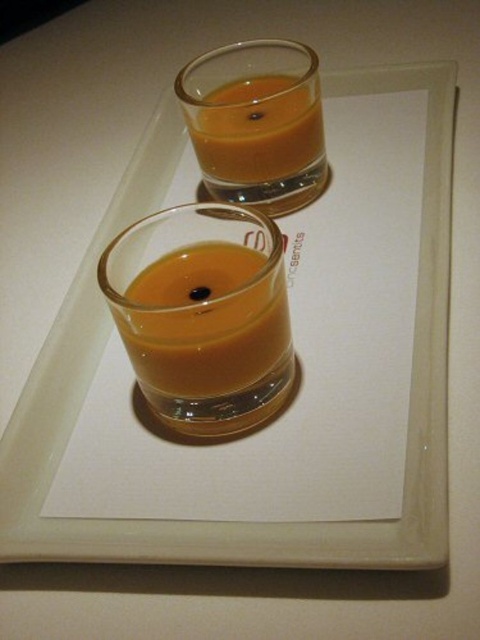
Question: Among these points, which one is nearest to the camera?

Choices:
 (A) (146, 369)
 (B) (254, 116)

Answer: (A)

Question: Does matte orange liquid at center come behind matte glass at upper center?

Choices:
 (A) yes
 (B) no

Answer: (B)

Question: Which point is closer to the camera taking this photo?

Choices:
 (A) tap(272, 134)
 (B) tap(265, 369)

Answer: (B)

Question: Is matte orange liquid at center thinner than matte glass at upper center?

Choices:
 (A) no
 (B) yes

Answer: (B)

Question: Is matte orange liquid at center below matte glass at upper center?

Choices:
 (A) yes
 (B) no

Answer: (A)